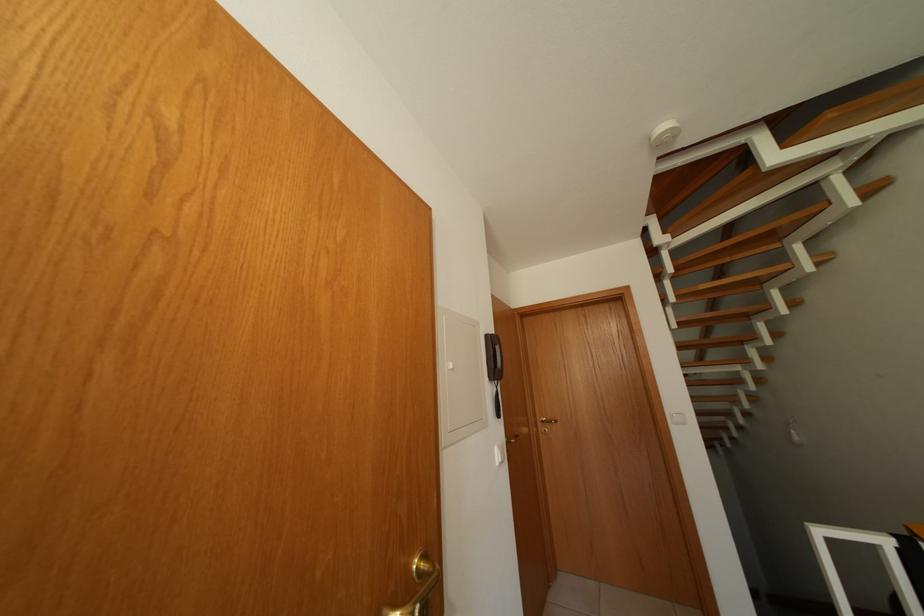
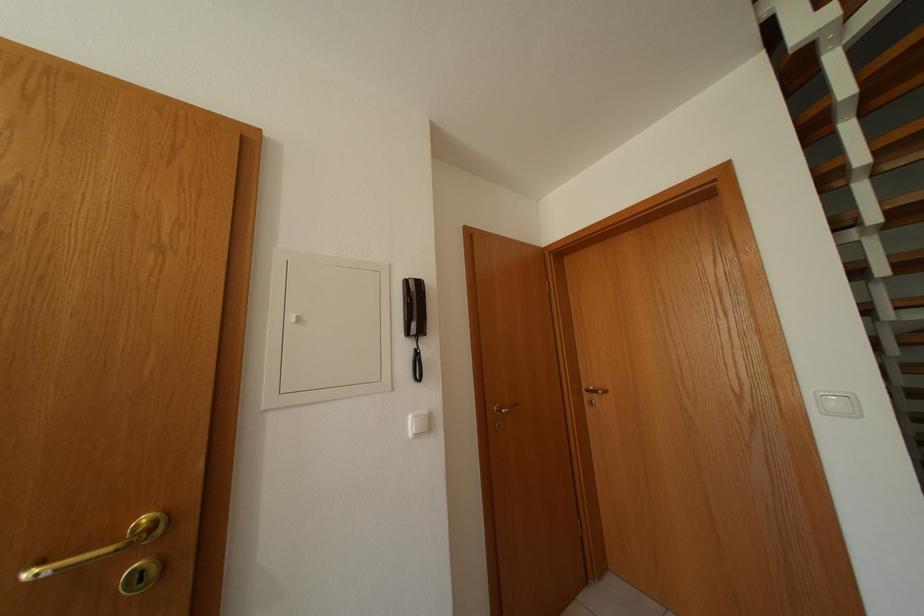
Which direction would the cameraman need to move to produce the second image?

The cameraman moved toward right, forward.